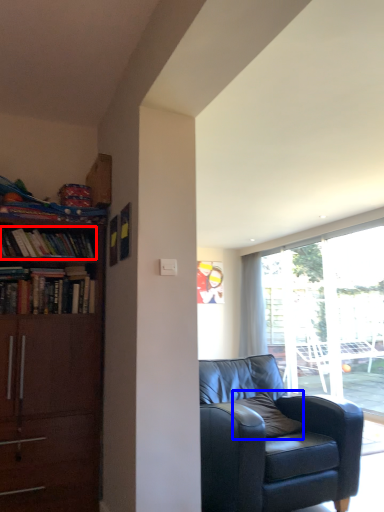
Question: Which object is further to the camera taking this photo, book (highlighted by a red box) or pillow (highlighted by a blue box)?

Choices:
 (A) book
 (B) pillow

Answer: (A)